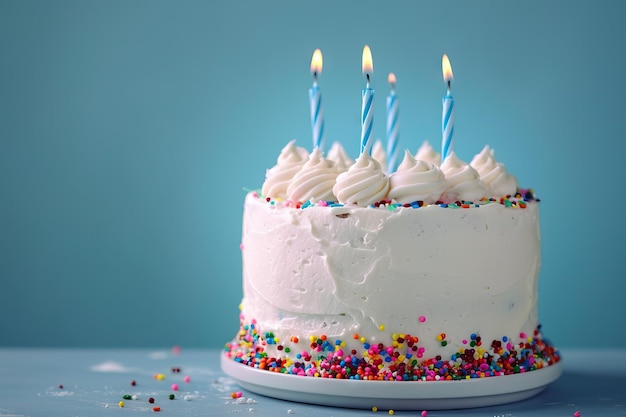
Where is `blue and white candle`? This screenshot has height=417, width=626. blue and white candle is located at coordinates (314, 113), (361, 112), (392, 115), (444, 112).